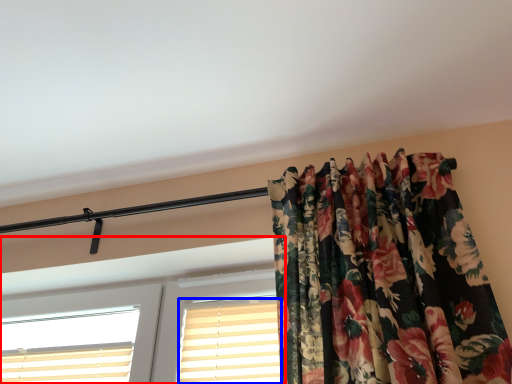
Question: Which of the following is the farthest to the observer, window (highlighted by a red box) or shutter (highlighted by a blue box)?

Choices:
 (A) window
 (B) shutter

Answer: (B)